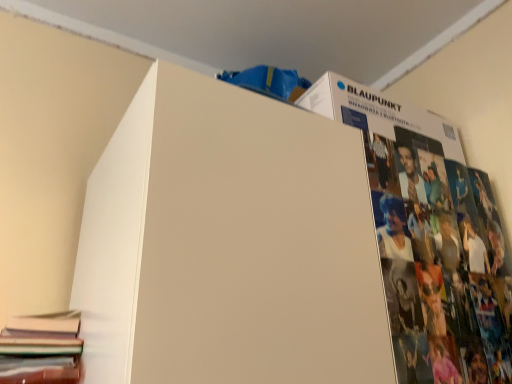
What is the approximate width of hardcover book at lower left?

It is 11.99 inches.

What do you see at coordinates (42, 349) in the screenshot? Image resolution: width=512 pixels, height=384 pixels. I see `hardcover book at lower left` at bounding box center [42, 349].

Measure the distance between point (68,336) and camera.

Point (68,336) is 33.35 inches away from camera.

What is the approximate height of hardcover book at lower left?

It is 2.70 inches.

The width and height of the screenshot is (512, 384). In order to click on hardcover book at lower left in this screenshot , I will do `click(42, 349)`.

This screenshot has width=512, height=384. In order to click on hardcover book at lower left in this screenshot , I will do `click(42, 349)`.